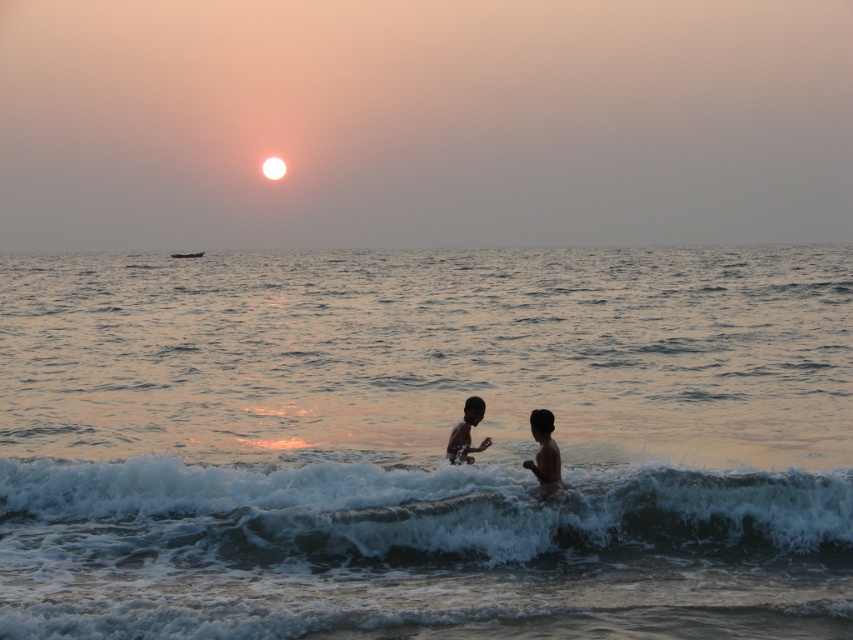
Question: Which point is closer to the camera?

Choices:
 (A) (460, 536)
 (B) (531, 461)
 (C) (35, 292)
 (D) (457, 456)

Answer: (A)

Question: Which point is farther from the camera taking this photo?

Choices:
 (A) (648, 548)
 (B) (488, 522)
 (C) (450, 461)

Answer: (C)

Question: Can you confirm if dark skin child at center is positioned below white foam surf at upper center?

Choices:
 (A) no
 (B) yes

Answer: (B)

Question: Which object is positioned farthest from the white foamy wave at lower center?

Choices:
 (A) white foam surf at upper center
 (B) translucent water at wave center
 (C) smooth skin child at center
 (D) dark skin child at center

Answer: (A)

Question: Can you confirm if white foamy wave at lower center is positioned above white foam surf at upper center?

Choices:
 (A) no
 (B) yes

Answer: (A)

Question: In this image, where is white foamy wave at lower center located relative to smooth skin child at center?

Choices:
 (A) left
 (B) right

Answer: (A)